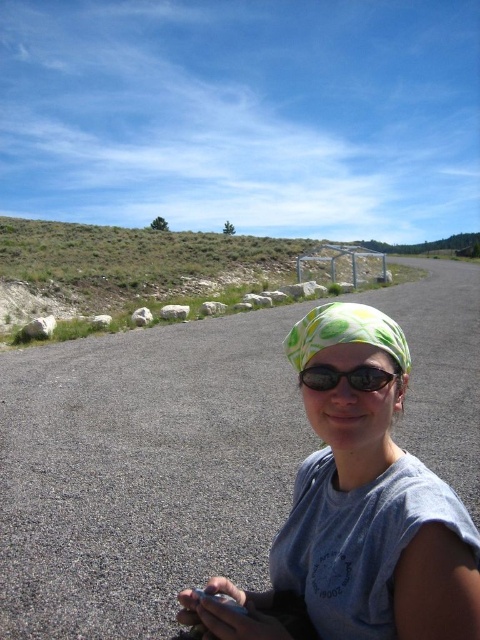
You are a photographer trying to capture the person in the image. The printed fabric headscarf at center is an important element. Where should you focus your camera to ensure the headscarf is in the frame?

The printed fabric headscarf at center is located at the 2D coordinates point (345, 332), so you should focus your camera at that point to ensure the headscarf is in the frame.